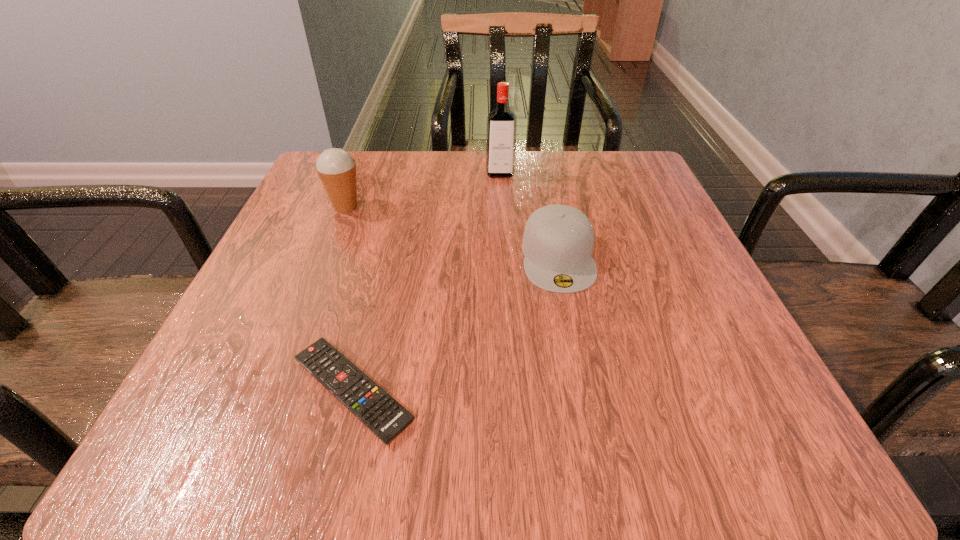
In the image, there is a desktop. Where is `vacant area at the near edge`? This screenshot has width=960, height=540. vacant area at the near edge is located at coordinates (555, 398).

Locate an element on the screen. The image size is (960, 540). free location at the left edge is located at coordinates (300, 221).

In the image, there is a desktop. Where is `vacant space at the right edge`? The width and height of the screenshot is (960, 540). vacant space at the right edge is located at coordinates (667, 269).

Identify the location of free space at the far right corner of the desktop. The image size is (960, 540). (640, 187).

Locate an element on the screen. The height and width of the screenshot is (540, 960). free space at the near right corner of the desktop is located at coordinates (778, 428).

Find the location of a particular element. The height and width of the screenshot is (540, 960). free space between the cap and the second farthest object is located at coordinates coord(452,232).

Identify the location of vacant region between the vodka and the nearest object. (426, 282).

Identify the location of free space between the cap and the farthest object. This screenshot has height=540, width=960. (529, 215).

The height and width of the screenshot is (540, 960). I want to click on free space that is in between the farthest object and the cap, so click(x=529, y=215).

Locate an element on the screen. This screenshot has height=540, width=960. vacant area between the cap and the third nearest object is located at coordinates (452, 232).